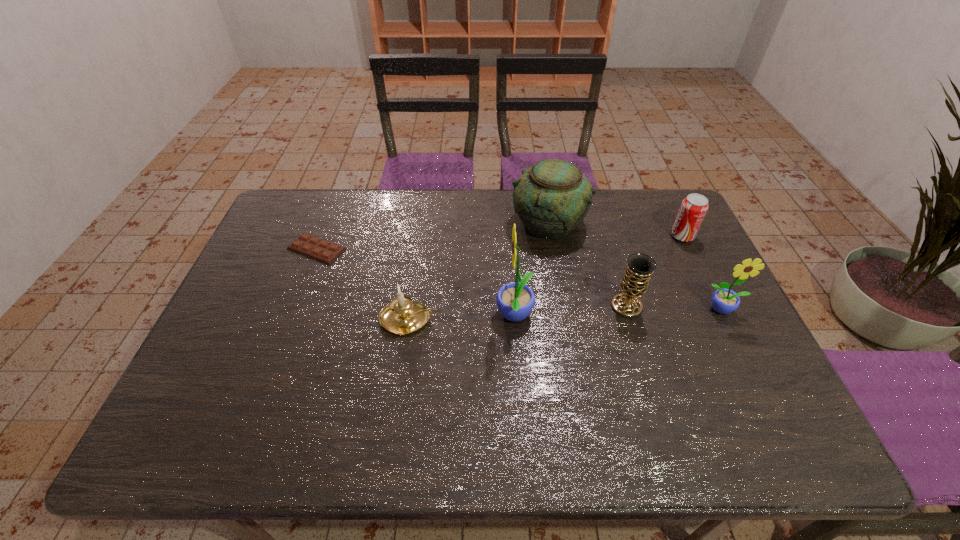
Image resolution: width=960 pixels, height=540 pixels. I want to click on free space located 0.320m on the front-facing side of the left sunflower, so click(377, 316).

Find the location of a particular element. The height and width of the screenshot is (540, 960). free point located on the front-facing side of the left sunflower is located at coordinates (411, 316).

Locate an element on the screen. The width and height of the screenshot is (960, 540). vacant space located on the front-facing side of the right sunflower is located at coordinates (752, 367).

Locate an element on the screen. The image size is (960, 540). free space located on the right of the shortest object is located at coordinates (423, 249).

The height and width of the screenshot is (540, 960). I want to click on free space located 0.100m on the front of the pottery, so click(x=557, y=271).

Where is `vacant space located 0.100m on the logo side of the soda can`? This screenshot has width=960, height=540. vacant space located 0.100m on the logo side of the soda can is located at coordinates (639, 236).

This screenshot has height=540, width=960. In order to click on vacant point located 0.320m on the logo side of the soda can in this screenshot , I will do pos(571,236).

Image resolution: width=960 pixels, height=540 pixels. What are the coordinates of `free space located 0.300m on the logo side of the soda can` in the screenshot? It's located at tap(577, 236).

Identify the location of free space located on the handle side of the sixth object from right to left. (493, 320).

Find the location of a particular element. free point located on the left of the chalice is located at coordinates (495, 306).